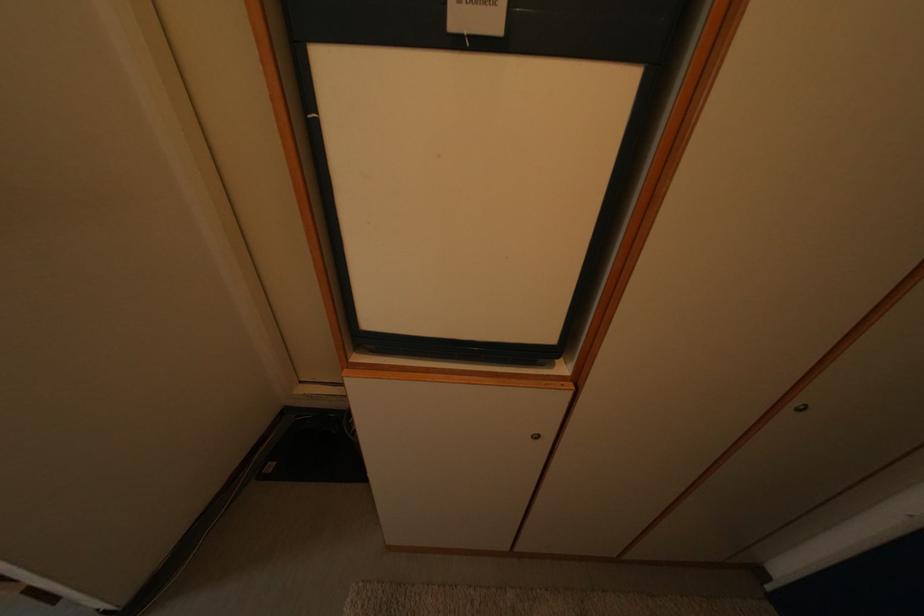
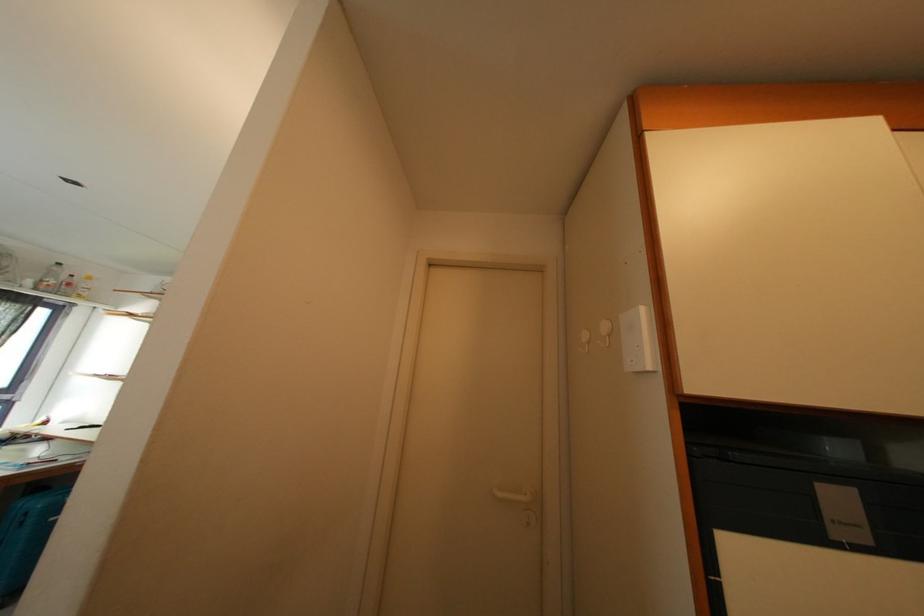
Question: Based on the continuous images, in which direction is the camera rotating? Reply with the corresponding letter.

Choices:
 (A) Left
 (B) Right
 (C) Up
 (D) Down

Answer: (C)